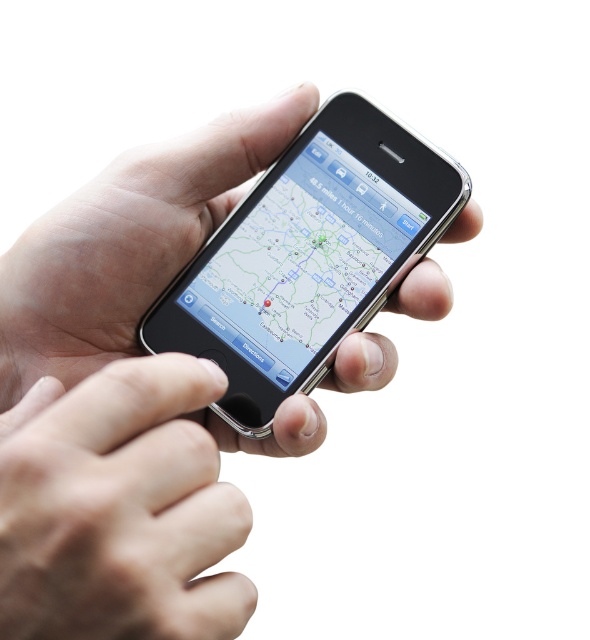
You are holding two phones, the silver metallic phone at center and the sleek silver phone at center, and you want to place them side by side on a shelf. If the shelf is 15 centimeters wide, will both phones fit without overlapping?

The silver metallic phone at center is 7.72 centimeters away from sleek silver phone at center. Since the total distance between them is 7.72 cm, which is less than the shelf width of 15 cm, both phones can fit side by side on the shelf without overlapping.